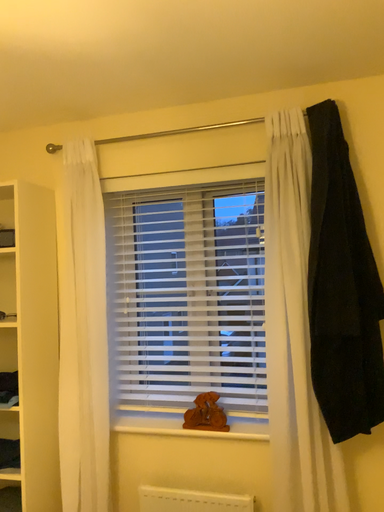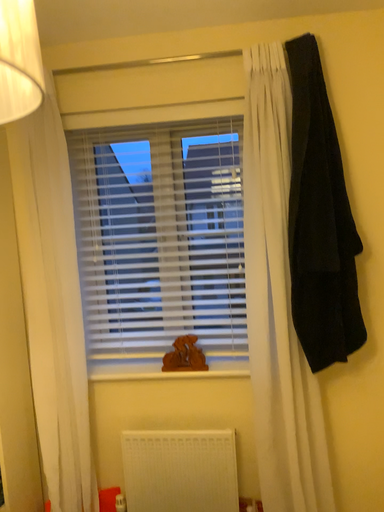
Question: Which way did the camera rotate in the video?

Choices:
 (A) rotated right
 (B) rotated left

Answer: (A)